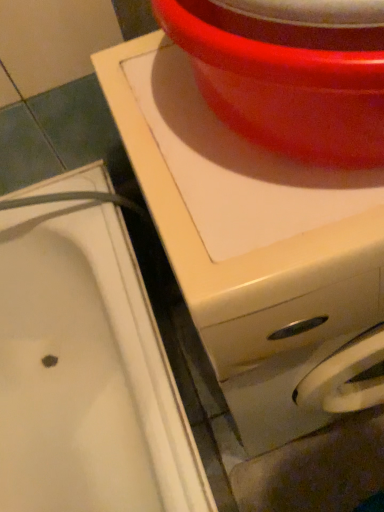
What is the approximate height of glossy plastic basin at upper center?

glossy plastic basin at upper center is 6.77 inches tall.

Where is `white glossy washing machine at upper center`? white glossy washing machine at upper center is located at coordinates (248, 240).

In the image, there is a white glossy washing machine at upper center. At what (x,y) coordinates should I click in order to perform the action: click on sink below it (from a real-world perspective). Please return your answer as a coordinate pair (x, y). Looking at the image, I should click on (86, 373).

Is white glossy washing machine at upper center positioned beyond the bounds of white glossy sink at lower left?

white glossy washing machine at upper center lies outside white glossy sink at lower left's area.

Does white glossy washing machine at upper center have a lesser width compared to white glossy sink at lower left?

In fact, white glossy washing machine at upper center might be wider than white glossy sink at lower left.

From a real-world perspective, is white glossy washing machine at upper center over white glossy sink at lower left?

Indeed, from a real-world perspective, white glossy washing machine at upper center stands above white glossy sink at lower left.

Which object is further away from the camera, glossy plastic basin at upper center or white glossy sink at lower left?

Positioned behind is white glossy sink at lower left.

From a real-world perspective, which is physically above, glossy plastic basin at upper center or white glossy sink at lower left?

glossy plastic basin at upper center, from a real-world perspective.

Can you confirm if glossy plastic basin at upper center is bigger than white glossy sink at lower left?

No.

Can you confirm if glossy plastic basin at upper center is taller than white glossy sink at lower left?

In fact, glossy plastic basin at upper center may be shorter than white glossy sink at lower left.

Between white glossy sink at lower left and white glossy washing machine at upper center, which one is positioned behind?

white glossy sink at lower left.

Is white glossy sink at lower left oriented away from white glossy washing machine at upper center?

No, white glossy sink at lower left is not facing away from white glossy washing machine at upper center.

Can we say white glossy sink at lower left lies outside white glossy washing machine at upper center?

Yes, white glossy sink at lower left is located beyond the bounds of white glossy washing machine at upper center.

How different are the orientations of white glossy sink at lower left and white glossy washing machine at upper center in degrees?

They differ by 88.4 degrees in their facing directions.

From a real-world perspective, which object rests below the other?

white glossy sink at lower left.

Is white glossy sink at lower left positioned with its back to glossy plastic basin at upper center?

white glossy sink at lower left is not turned away from glossy plastic basin at upper center.

Measure the distance between white glossy sink at lower left and glossy plastic basin at upper center.

A distance of 23.22 inches exists between white glossy sink at lower left and glossy plastic basin at upper center.

From the image's perspective, is glossy plastic basin at upper center on top of white glossy washing machine at upper center?

Yes, from the image's perspective, glossy plastic basin at upper center is over white glossy washing machine at upper center.

Can you see glossy plastic basin at upper center touching white glossy washing machine at upper center?

No, glossy plastic basin at upper center is not beside white glossy washing machine at upper center.

Measure the distance between glossy plastic basin at upper center and white glossy washing machine at upper center.

The distance of glossy plastic basin at upper center from white glossy washing machine at upper center is 13.11 centimeters.

Which object is closer to the camera taking this photo, glossy plastic basin at upper center or white glossy washing machine at upper center?

glossy plastic basin at upper center is in front.

Between white glossy washing machine at upper center and glossy plastic basin at upper center, which one is positioned behind?

white glossy washing machine at upper center is behind.

What's the angular difference between white glossy washing machine at upper center and glossy plastic basin at upper center's facing directions?

The angle between the facing direction of white glossy washing machine at upper center and the facing direction of glossy plastic basin at upper center is 4.43e-05 degrees.

From the image's perspective, which one is positioned lower, white glossy washing machine at upper center or glossy plastic basin at upper center?

white glossy washing machine at upper center appears lower in the image.

Does point (346, 333) lie in front of point (299, 17)?

No.

Locate an element on the screen. appliance above the white glossy sink at lower left (from a real-world perspective) is located at coordinates (248, 240).

In order to click on basin in front of the white glossy sink at lower left in this screenshot , I will do `click(290, 72)`.

From the image, which object appears to be nearer to white glossy sink at lower left, glossy plastic basin at upper center or white glossy washing machine at upper center?

white glossy washing machine at upper center.

Which object lies further to the anchor point glossy plastic basin at upper center, white glossy washing machine at upper center or white glossy sink at lower left?

white glossy sink at lower left lies further to glossy plastic basin at upper center than the other object.

When comparing their distances from glossy plastic basin at upper center, does white glossy sink at lower left or white glossy washing machine at upper center seem closer?

white glossy washing machine at upper center is positioned closer to the anchor glossy plastic basin at upper center.

Looking at this image, when comparing their distances from white glossy washing machine at upper center, does white glossy sink at lower left or glossy plastic basin at upper center seem further?

The object further to white glossy washing machine at upper center is white glossy sink at lower left.

Based on their spatial positions, is white glossy washing machine at upper center or glossy plastic basin at upper center further from white glossy sink at lower left?

glossy plastic basin at upper center.

Looking at the image, which one is located further to white glossy washing machine at upper center, glossy plastic basin at upper center or white glossy sink at lower left?

white glossy sink at lower left is further to white glossy washing machine at upper center.

I want to click on basin situated between white glossy sink at lower left and white glossy washing machine at upper center from left to right, so (x=290, y=72).